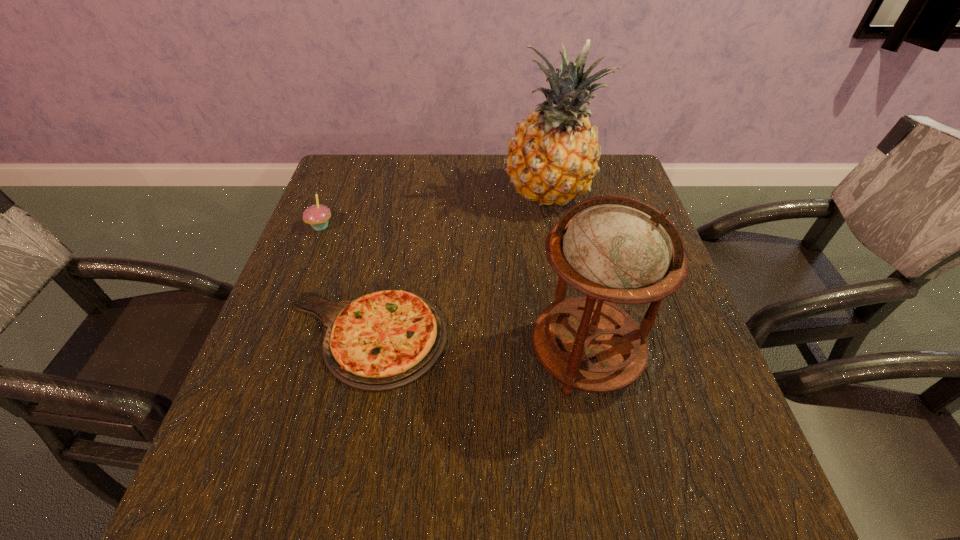
Locate an element on the screen. pizza located at the left edge is located at coordinates (384, 340).

Where is `pineapple that is at the right edge`? The width and height of the screenshot is (960, 540). pineapple that is at the right edge is located at coordinates (552, 158).

The height and width of the screenshot is (540, 960). Identify the location of globe present at the right edge. (616, 249).

Locate an element on the screen. This screenshot has height=540, width=960. object that is at the far right corner is located at coordinates [552, 158].

Find the location of a particular element. Image resolution: width=960 pixels, height=540 pixels. vacant area at the far edge is located at coordinates (479, 200).

Find the location of `free region at the near edge`. free region at the near edge is located at coordinates (450, 472).

In the image, there is a desktop. Identify the location of free space at the left edge. (282, 460).

Locate an element on the screen. free location at the right edge of the desktop is located at coordinates (656, 414).

In the image, there is a desktop. At what (x,y) coordinates should I click in order to perform the action: click on free space at the far right corner. Please return your answer as a coordinate pair (x, y). The height and width of the screenshot is (540, 960). Looking at the image, I should click on (620, 165).

This screenshot has width=960, height=540. Identify the location of free spot between the cupcake and the pizza. (343, 282).